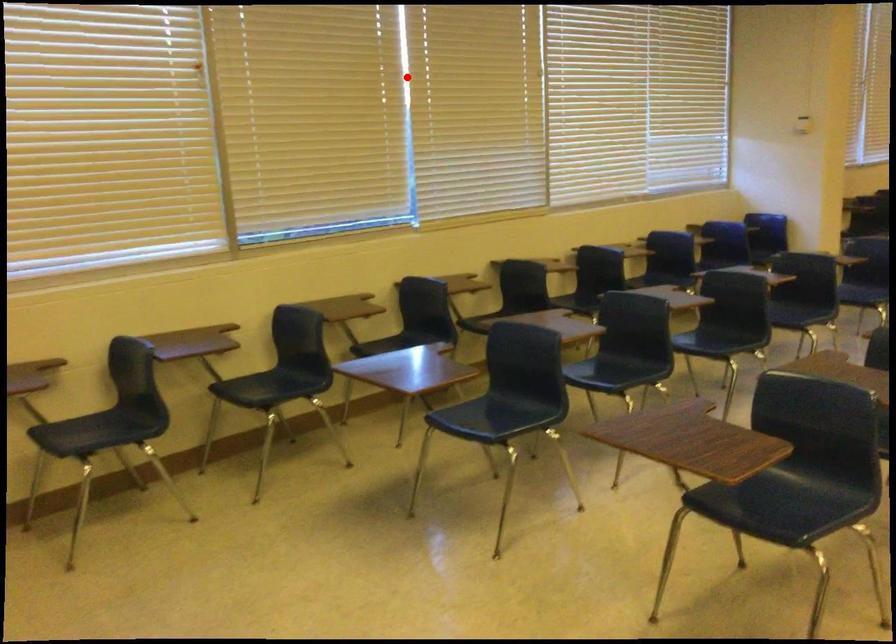
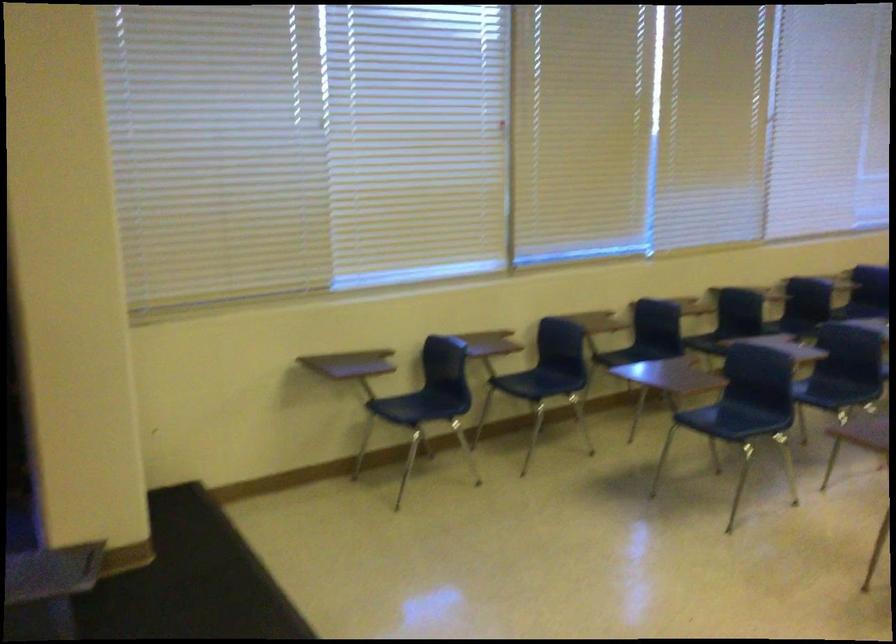
Question: I am providing you with two images of the same scene from different viewpoints. A red point is shown in image1. For the corresponding object point in image2, is it positioned nearer or farther from the camera?

Choices:
 (A) Nearer
 (B) Farther

Answer: (B)